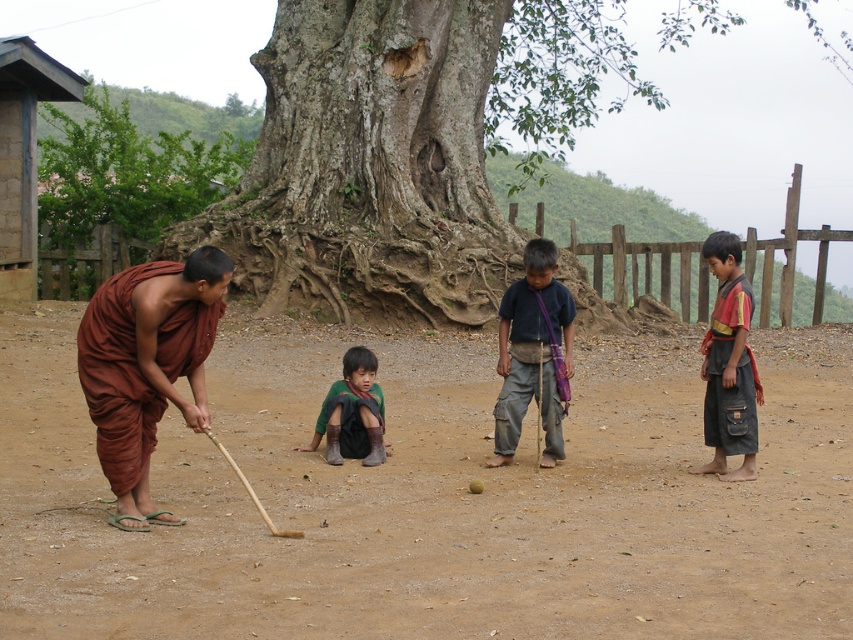
You are standing at the point marked as point (431,497) in the image. What type of surface are you standing on?

You are standing on a brown dirt field at center.